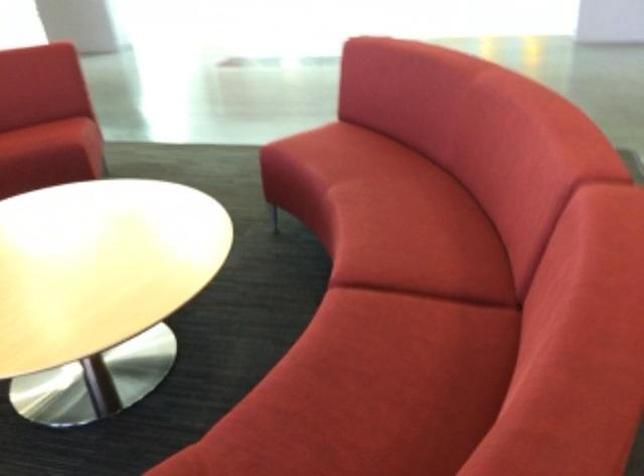
The height and width of the screenshot is (476, 644). What do you see at coordinates (418, 239) in the screenshot?
I see `a red sofa sitting surface` at bounding box center [418, 239].